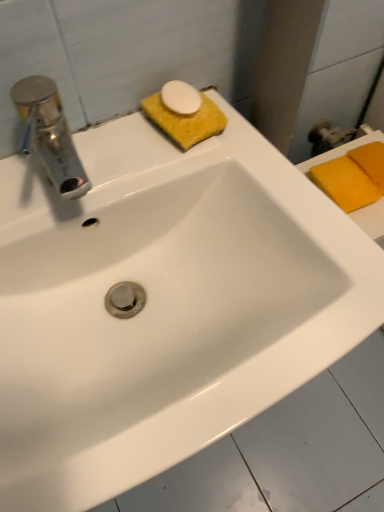
Question: Is yellow sponge at right, positioned as the 3th soap in left-to-right order, turned away from yellow sponge at upper center, the 3th soap viewed from the right?

Choices:
 (A) no
 (B) yes

Answer: (A)

Question: Would you consider yellow sponge at right, positioned as the 3th soap in left-to-right order, to be distant from yellow sponge at upper center, the 3th soap viewed from the right?

Choices:
 (A) no
 (B) yes

Answer: (A)

Question: Does yellow sponge at right, positioned as the 3th soap in left-to-right order, turn towards yellow sponge at upper center, acting as the 1th soap starting from the front?

Choices:
 (A) yes
 (B) no

Answer: (B)

Question: Is yellow sponge at upper center, positioned as the 1th soap in left-to-right order, located within yellow sponge at right, the third soap from the front?

Choices:
 (A) yes
 (B) no

Answer: (B)

Question: Is yellow sponge at right, positioned as the 3th soap in left-to-right order, further to the viewer compared to yellow sponge at upper center, positioned as the 1th soap in left-to-right order?

Choices:
 (A) yes
 (B) no

Answer: (A)

Question: Relative to yellow sponge at upper center, which is the 3th soap in back-to-front order, is yellow sponge at right, positioned as the 3th soap in left-to-right order, in front or behind?

Choices:
 (A) front
 (B) behind

Answer: (B)

Question: Is yellow sponge at right, which is the 1th soap in back-to-front order, bigger or smaller than yellow sponge at upper center, which is the 3th soap in back-to-front order?

Choices:
 (A) small
 (B) big

Answer: (B)

Question: Is point (377, 153) closer or farther from the camera than point (188, 125)?

Choices:
 (A) closer
 (B) farther

Answer: (B)

Question: From a real-world perspective, is yellow sponge at right, which is the 1th soap in back-to-front order, positioned above or below yellow sponge at upper center, the 3th soap viewed from the right?

Choices:
 (A) below
 (B) above

Answer: (A)

Question: Based on their sizes in the image, would you say orange sponge at upper right, arranged as the 2th soap when viewed from the front, is bigger or smaller than yellow sponge at right, which is the 1th soap in back-to-front order?

Choices:
 (A) small
 (B) big

Answer: (A)

Question: Based on their positions, is orange sponge at upper right, arranged as the 2th soap when viewed from the front, located to the left or right of yellow sponge at right, positioned as the 3th soap in left-to-right order?

Choices:
 (A) left
 (B) right

Answer: (A)

Question: Is point (342, 183) closer or farther from the camera than point (370, 166)?

Choices:
 (A) closer
 (B) farther

Answer: (A)

Question: Which is correct: orange sponge at upper right, acting as the second soap starting from the left, is inside yellow sponge at right, the third soap from the front, or outside of it?

Choices:
 (A) inside
 (B) outside

Answer: (B)

Question: In terms of height, does yellow sponge at upper center, which is the 3th soap in back-to-front order, look taller or shorter compared to yellow sponge at right, which is the 1th soap in back-to-front order?

Choices:
 (A) short
 (B) tall

Answer: (A)

Question: Is yellow sponge at upper center, acting as the 1th soap starting from the front, inside the boundaries of yellow sponge at right, positioned as the 3th soap in left-to-right order, or outside?

Choices:
 (A) outside
 (B) inside

Answer: (A)